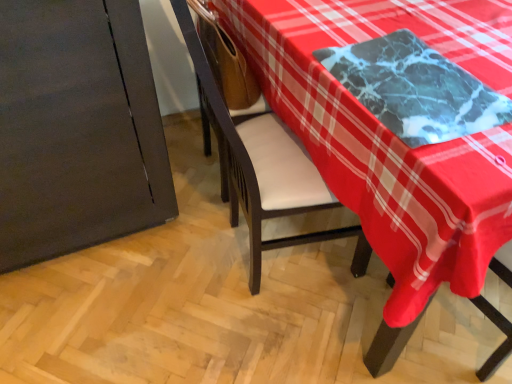
Image resolution: width=512 pixels, height=384 pixels. What are the coordinates of `marble table at upper right` in the screenshot? It's located at (393, 140).

From the image's perspective, which one is positioned lower, marble-like black tray at upper right or marble table at upper right?

marble table at upper right is shown below in the image.

Are marble-like black tray at upper right and marble table at upper right far apart?

No, marble-like black tray at upper right is not far from marble table at upper right.

Visually, is marble-like black tray at upper right positioned to the left or to the right of marble table at upper right?

Based on their positions, marble-like black tray at upper right is located to the right of marble table at upper right.

Who is shorter, marble-like black tray at upper right or marble table at upper right?

With less height is marble-like black tray at upper right.

From the image's perspective, which is above, marble table at upper right or marble-like black tray at upper right?

marble-like black tray at upper right.

Is marble table at upper right in front of or behind marble-like black tray at upper right in the image?

Visually, marble table at upper right is located behind marble-like black tray at upper right.

Can you confirm if marble table at upper right is bigger than marble-like black tray at upper right?

Indeed, marble table at upper right has a larger size compared to marble-like black tray at upper right.

From a real-world perspective, is marble table at upper right physically below marble-like black tray at upper right?

Yes.

The height and width of the screenshot is (384, 512). I want to click on cloth that appears on the right of wooden armchair at center, so click(415, 89).

Is wooden armchair at center a part of marble-like black tray at upper right?

Definitely not — wooden armchair at center is not inside marble-like black tray at upper right.

Does marble-like black tray at upper right have a lesser height compared to wooden armchair at center?

Yes, marble-like black tray at upper right is shorter than wooden armchair at center.

Which object is more forward, marble-like black tray at upper right or wooden armchair at center?

marble-like black tray at upper right is closer to the camera.

From the image's perspective, is wooden armchair at center located above or below marble-like black tray at upper right?

wooden armchair at center is situated higher than marble-like black tray at upper right in the image.

Which is in front, point (224, 49) or point (391, 90)?

Positioned in front is point (391, 90).

Considering the relative positions of wooden armchair at center and marble-like black tray at upper right in the image provided, is wooden armchair at center to the right of marble-like black tray at upper right from the viewer's perspective?

In fact, wooden armchair at center is to the left of marble-like black tray at upper right.

Between wooden armchair at center and marble-like black tray at upper right, which one has larger width?

With larger width is marble-like black tray at upper right.

From the image's perspective, is wooden armchair at center above or below marble table at upper right?

From the image's perspective, wooden armchair at center appears above marble table at upper right.

Identify the location of armchair behind the marble table at upper right. coord(227,66).

Could you tell me if wooden armchair at center is facing marble table at upper right?

No.

How many degrees apart are the facing directions of marble table at upper right and wooden armchair at center?

179 degrees separate the facing orientations of marble table at upper right and wooden armchair at center.

Can you see marble table at upper right touching wooden armchair at center?

No, marble table at upper right is not with wooden armchair at center.

Based on the photo, between marble table at upper right and wooden armchair at center, which one has less height?

Standing shorter between the two is marble table at upper right.

You are a GUI agent. You are given a task and a screenshot of the screen. Output one action in this format:
    pyautogui.click(x=<x>, y=<y>)
    Task: Click on the table on the left of the marble-like black tray at upper right
    
    Given the screenshot: What is the action you would take?
    click(393, 140)

You are a GUI agent. You are given a task and a screenshot of the screen. Output one action in this format:
    pyautogui.click(x=<x>, y=<y>)
    Task: Click on the table below the marble-like black tray at upper right (from a real-world perspective)
    
    Given the screenshot: What is the action you would take?
    pyautogui.click(x=393, y=140)

Estimate the real-world distances between objects in this image. Which object is further from wooden armchair at center, marble table at upper right or marble-like black tray at upper right?

Among the two, marble-like black tray at upper right is located further to wooden armchair at center.

Estimate the real-world distances between objects in this image. Which object is further from marble table at upper right, wooden armchair at center or marble-like black tray at upper right?

Among the two, wooden armchair at center is located further to marble table at upper right.

From the image, which object appears to be nearer to marble-like black tray at upper right, wooden armchair at center or marble table at upper right?

marble table at upper right.

Looking at the image, which one is located further to marble table at upper right, marble-like black tray at upper right or wooden armchair at center?

The object further to marble table at upper right is wooden armchair at center.

From the image, which object appears to be farther from marble-like black tray at upper right, marble table at upper right or wooden armchair at center?

The object further to marble-like black tray at upper right is wooden armchair at center.

From the image, which object appears to be farther from wooden armchair at center, marble-like black tray at upper right or marble table at upper right?

marble-like black tray at upper right.

Locate an element on the screen. The height and width of the screenshot is (384, 512). cloth between wooden armchair at center and marble table at upper right in the up-down direction is located at coordinates (415, 89).